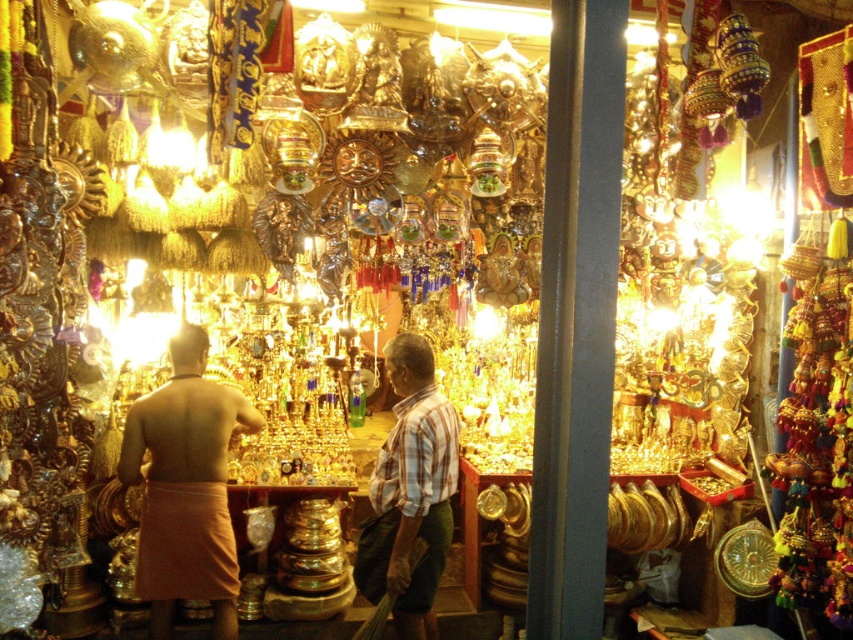
How far apart are orange fabric cloth at center and plaid fabric shirt at center?

orange fabric cloth at center and plaid fabric shirt at center are 83.83 centimeters apart.

How distant is orange fabric cloth at center from plaid fabric shirt at center?

orange fabric cloth at center and plaid fabric shirt at center are 33.00 inches apart.

What do you see at coordinates (184, 486) in the screenshot? I see `orange fabric cloth at center` at bounding box center [184, 486].

The height and width of the screenshot is (640, 853). I want to click on orange fabric cloth at center, so click(184, 486).